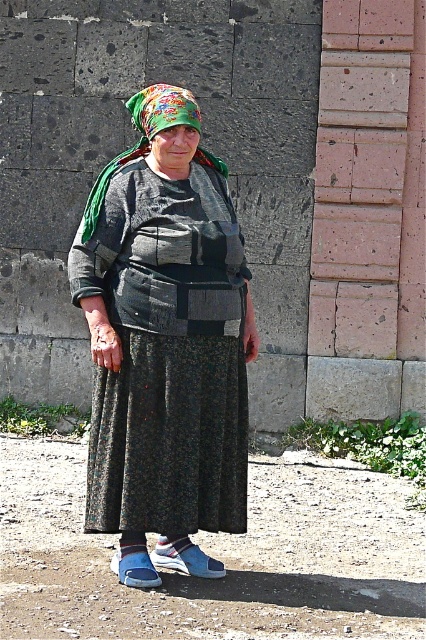
Question: Which point is farther from the camera taking this photo?

Choices:
 (A) (100, 184)
 (B) (161, 353)

Answer: (A)

Question: Does dark gray textured sweater at center have a lesser width compared to floral fabric headscarf at center?

Choices:
 (A) yes
 (B) no

Answer: (B)

Question: Is dark gray textured sweater at center below floral fabric headscarf at center?

Choices:
 (A) yes
 (B) no

Answer: (A)

Question: Does dark gray textured sweater at center have a smaller size compared to floral fabric headscarf at center?

Choices:
 (A) yes
 (B) no

Answer: (B)

Question: Which of the following is the closest to the observer?

Choices:
 (A) floral fabric headscarf at center
 (B) dark gray textured sweater at center

Answer: (B)